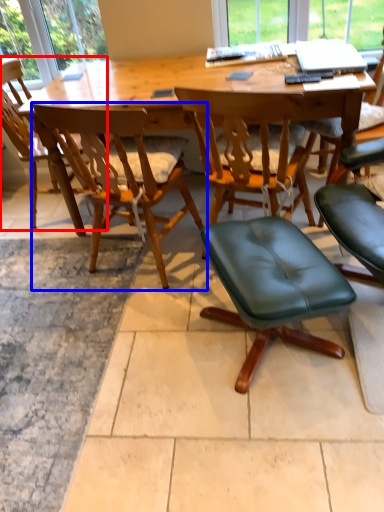
Question: Which of the following is the closest to the observer, chair (highlighted by a red box) or chair (highlighted by a blue box)?

Choices:
 (A) chair
 (B) chair

Answer: (B)